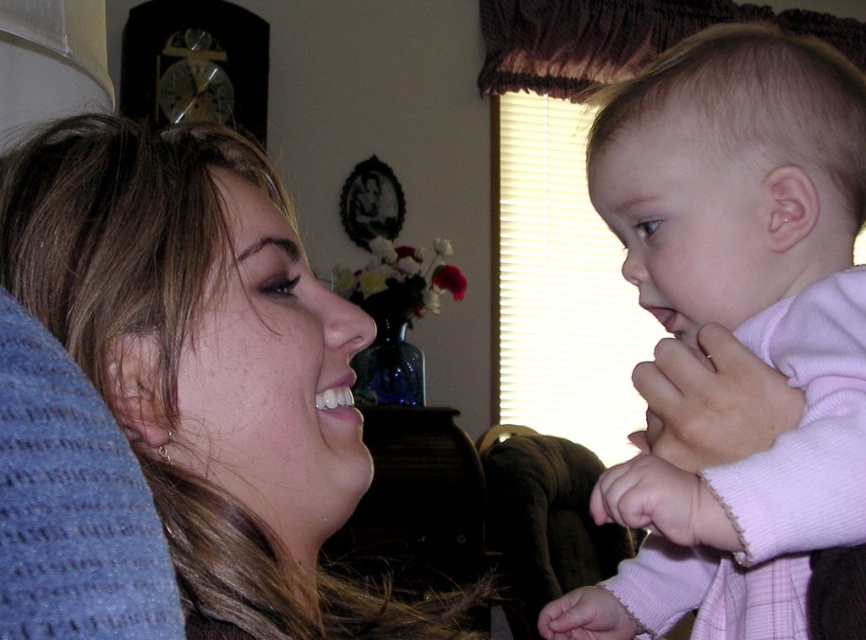
You are a photographer trying to capture a closeup of the pink fleece baby at center. You notice the matte blue pillow at lower left is blocking part of the baby. Can you move the pillow closer to the camera to get a better shot?

The matte blue pillow at lower left is already closer to the viewer than the pink fleece baby at center. Moving it closer would place it even further in front, potentially blocking more of the baby. To get a better shot, you should move the pillow away from the camera so it moves behind and out of the way of the pink fleece baby at center.

You are designing a nursery and need to place a matte blue pillow at lower left and a pink fleece baby at center. Given their sizes, which object will require more horizontal space on the shelf?

The matte blue pillow at lower left requires more horizontal space because its width is larger than the pink fleece baby at center.

You are a photographer trying to capture the perfect shot of the scene. The matte blue pillow at lower left is an important element in the composition. If you want to ensure it stays in the frame, where should you position your camera relative to the current viewpoint?

The matte blue pillow at lower left is located at point (209, 365). To keep it in the frame, position the camera so that the lower left area of the image remains visible.